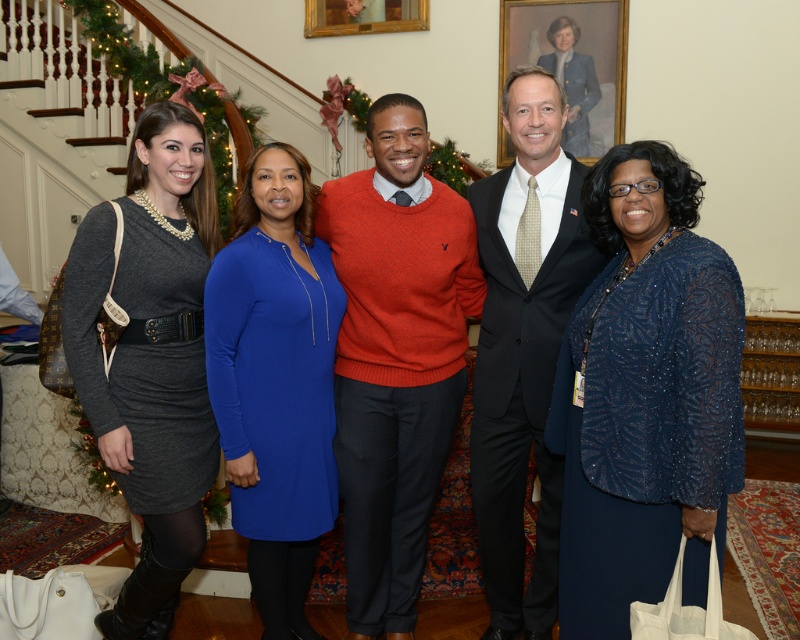
You are standing at the bottom of the staircase in the image and want to greet both the matte gray dress at left and the dark suit at center. Which person should you approach first based on their proximity to you?

You should approach the matte gray dress at left first because they are closer to you than the dark suit at center, which is further away.